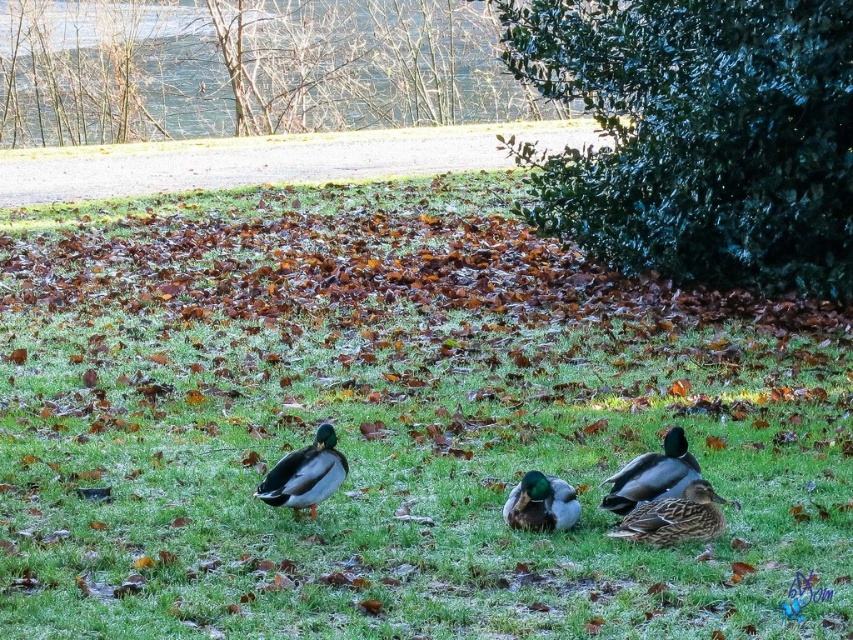
Question: Which point is closer to the camera taking this photo?

Choices:
 (A) (x=819, y=556)
 (B) (x=305, y=502)
 (C) (x=659, y=472)

Answer: (A)

Question: Which point is farther to the camera?

Choices:
 (A) green leafy bush at center
 (B) green grassy at center

Answer: (A)

Question: Can you confirm if green glossy duck at center is positioned to the left of brown matte duck at lower right?

Choices:
 (A) no
 (B) yes

Answer: (B)

Question: Is green grassy at center smaller than green glossy duck at center?

Choices:
 (A) no
 (B) yes

Answer: (A)

Question: Is green leafy bush at center positioned at the back of green leafy tree at upper center?

Choices:
 (A) yes
 (B) no

Answer: (B)

Question: Which object is positioned closest to the shiny brown duck at lower right?

Choices:
 (A) green glossy duck at center
 (B) brown matte duck at lower right
 (C) green leafy tree at upper center

Answer: (B)